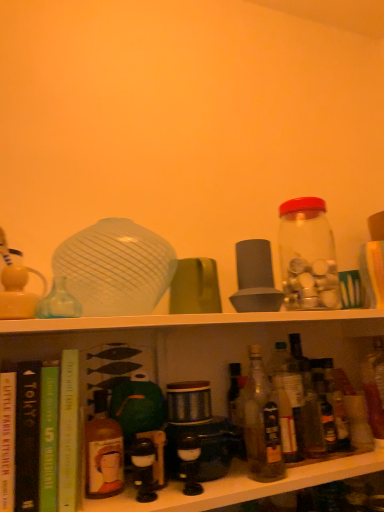
This screenshot has height=512, width=384. Describe the element at coordinates (262, 424) in the screenshot. I see `translucent glass bottle at center, the 3th bottle viewed from the left` at that location.

The height and width of the screenshot is (512, 384). What do you see at coordinates (59, 302) in the screenshot?
I see `transparent glass bottle at left, marked as the first bottle in a left-to-right arrangement` at bounding box center [59, 302].

What do you see at coordinates (7, 440) in the screenshot? I see `hardcover book at left, placed as the fourth book when sorted from right to left` at bounding box center [7, 440].

What do you see at coordinates (103, 451) in the screenshot? This screenshot has width=384, height=512. I see `matte brown glass bottle at center-left, arranged as the 4th bottle when viewed from the right` at bounding box center [103, 451].

In order to click on translucent glass bottle at center, acting as the third bottle starting from the right in this screenshot , I will do `click(262, 424)`.

From a real-world perspective, which is physically above, matte brown glass bottle at center-left, positioned as the second bottle in left-to-right order, or translucent glass bottle at center, the 3th bottle viewed from the left?

translucent glass bottle at center, the 3th bottle viewed from the left, is physically above.

Which point is more distant from viewer, (x=95, y=442) or (x=268, y=405)?

The point (x=268, y=405) is more distant.

Does green matte book at lower left, which is the 2th book from right to left, have a greater height compared to transparent glass bottle at left, marked as the 5th bottle in a right-to-left arrangement?

Yes, green matte book at lower left, which is the 2th book from right to left, is taller than transparent glass bottle at left, marked as the 5th bottle in a right-to-left arrangement.

From the image's perspective, which is below, green matte book at lower left, arranged as the third book when viewed from the left, or transparent glass bottle at left, marked as the first bottle in a left-to-right arrangement?

green matte book at lower left, arranged as the third book when viewed from the left, appears lower in the image.

Can you confirm if green matte book at lower left, arranged as the third book when viewed from the left, is thinner than transparent glass bottle at left, marked as the 5th bottle in a right-to-left arrangement?

No.

Is green matte book at lower left, which is the 2th book from right to left, positioned with its back to transparent glass bottle at left, marked as the first bottle in a left-to-right arrangement?

green matte book at lower left, which is the 2th book from right to left, does not have its back to transparent glass bottle at left, marked as the first bottle in a left-to-right arrangement.

Is green matte book at lower left, arranged as the third book when viewed from the left, outside of hardcover book at center, the first book in the right-to-left sequence?

Yes.

Consider the image. Between green matte book at lower left, which is the 2th book from right to left, and hardcover book at center, acting as the fourth book starting from the left, which one has larger size?

Bigger between the two is hardcover book at center, acting as the fourth book starting from the left.

Can you confirm if green matte book at lower left, arranged as the third book when viewed from the left, is positioned to the left of hardcover book at center, the first book in the right-to-left sequence?

Yes.

Which is more to the left, green matte mug at center, the first tableware viewed from the right, or translucent glass bottle at center, which appears as the 2th bottle when viewed from the right?

green matte mug at center, the first tableware viewed from the right, is more to the left.

Based on the photo, does green matte mug at center, which is counted as the 2th tableware, starting from the left, have a lesser height compared to translucent glass bottle at center, which appears as the 2th bottle when viewed from the right?

Yes, green matte mug at center, which is counted as the 2th tableware, starting from the left, is shorter than translucent glass bottle at center, which appears as the 2th bottle when viewed from the right.

Does point (196, 306) lie behind point (294, 431)?

No, (196, 306) is in front of (294, 431).

Considering the points (13, 267) and (21, 429), which point is behind, point (13, 267) or point (21, 429)?

The point (13, 267) is more distant.

Considering the sizes of matte white teapot at left and black matte book at left, positioned as the third book in right-to-left order, in the image, is matte white teapot at left wider or thinner than black matte book at left, positioned as the third book in right-to-left order,?

Considering their sizes, matte white teapot at left looks slimmer than black matte book at left, positioned as the third book in right-to-left order.

From a real-world perspective, who is located lower, matte white teapot at left or black matte book at left, positioned as the third book in right-to-left order?

In real-world perspective, black matte book at left, positioned as the third book in right-to-left order, is lower.

Could you measure the distance between matte white teapot at left and black matte book at left, positioned as the third book in right-to-left order?

matte white teapot at left and black matte book at left, positioned as the third book in right-to-left order, are 7.13 inches apart from each other.

Can you confirm if transparent glass bottle at left, marked as the 5th bottle in a right-to-left arrangement, is bigger than green matte book at lower left, which is the 2th book from right to left?

Incorrect, transparent glass bottle at left, marked as the 5th bottle in a right-to-left arrangement, is not larger than green matte book at lower left, which is the 2th book from right to left.

From a real-world perspective, is transparent glass bottle at left, marked as the first bottle in a left-to-right arrangement, physically located above or below green matte book at lower left, arranged as the third book when viewed from the left?

transparent glass bottle at left, marked as the first bottle in a left-to-right arrangement, is situated higher than green matte book at lower left, arranged as the third book when viewed from the left, in the real world.

Is transparent glass bottle at left, marked as the 5th bottle in a right-to-left arrangement, thinner than green matte book at lower left, arranged as the third book when viewed from the left?

Indeed, transparent glass bottle at left, marked as the 5th bottle in a right-to-left arrangement, has a lesser width compared to green matte book at lower left, arranged as the third book when viewed from the left.

Is transparent glass bottle at left, marked as the first bottle in a left-to-right arrangement, situated inside green matte book at lower left, arranged as the third book when viewed from the left, or outside?

transparent glass bottle at left, marked as the first bottle in a left-to-right arrangement, exists outside the volume of green matte book at lower left, arranged as the third book when viewed from the left.

From a real-world perspective, between translucent glass bottle at center, the 3th bottle viewed from the left, and matte brown glass bottle at center-left, positioned as the second bottle in left-to-right order, who is vertically higher?

translucent glass bottle at center, the 3th bottle viewed from the left, is physically above.

From the image's perspective, is translucent glass bottle at center, acting as the third bottle starting from the right, located above matte brown glass bottle at center-left, positioned as the second bottle in left-to-right order?

Correct, translucent glass bottle at center, acting as the third bottle starting from the right, appears higher than matte brown glass bottle at center-left, positioned as the second bottle in left-to-right order, in the image.

Between translucent glass bottle at center, acting as the third bottle starting from the right, and matte brown glass bottle at center-left, arranged as the 4th bottle when viewed from the right, which one has smaller size?

matte brown glass bottle at center-left, arranged as the 4th bottle when viewed from the right, is smaller.

Considering the sizes of translucent glass bottle at center, acting as the third bottle starting from the right, and matte brown glass bottle at center-left, positioned as the second bottle in left-to-right order, in the image, is translucent glass bottle at center, acting as the third bottle starting from the right, wider or thinner than matte brown glass bottle at center-left, positioned as the second bottle in left-to-right order,?

In the image, translucent glass bottle at center, acting as the third bottle starting from the right, appears to be wider than matte brown glass bottle at center-left, positioned as the second bottle in left-to-right order.

At what (x,y) coordinates should I click in order to perform the action: click on the 1st bottle behind the matte brown glass bottle at center-left, positioned as the second bottle in left-to-right order. Please return your answer as a coordinate pair (x, y). Looking at the image, I should click on (262, 424).

From the image's perspective, starting from the transparent glass bottle at left, marked as the 5th bottle in a right-to-left arrangement, which book is the 4th one below? Please provide its 2D coordinates.

[(49, 437)]

When comparing their distances from translucent glass vase at upper center, the first tableware from the left, does black matte book at left, positioned as the third book in right-to-left order, or green matte mug at center, the first tableware viewed from the right, seem closer?

Based on the image, green matte mug at center, the first tableware viewed from the right, appears to be nearer to translucent glass vase at upper center, the first tableware from the left.

When comparing their distances from transparent glass bottle at left, marked as the first bottle in a left-to-right arrangement, does green matte book at lower left, which is the 2th book from right to left, or matte white teapot at left seem closer?

The object closer to transparent glass bottle at left, marked as the first bottle in a left-to-right arrangement, is matte white teapot at left.

Which object lies further to the anchor point transparent glass bottle at left, marked as the 5th bottle in a right-to-left arrangement, black matte book at left, the 2th book in the left-to-right sequence, or green matte mug at center, the first tableware viewed from the right?

The object further to transparent glass bottle at left, marked as the 5th bottle in a right-to-left arrangement, is green matte mug at center, the first tableware viewed from the right.

Based on their spatial positions, is black matte book at left, positioned as the third book in right-to-left order, or transparent glass jar at upper right, the fifth bottle from the left, further from green matte mug at center, the first tableware viewed from the right?

The object further to green matte mug at center, the first tableware viewed from the right, is black matte book at left, positioned as the third book in right-to-left order.

Considering their positions, is translucent glass vase at upper center, the first tableware from the left, positioned further to translucent glass bottle at center, which appears as the 2th bottle when viewed from the right, than green matte mug at center, which is counted as the 2th tableware, starting from the left?

The object further to translucent glass bottle at center, which appears as the 2th bottle when viewed from the right, is translucent glass vase at upper center, the first tableware from the left.

Considering their positions, is hardcover book at left, which is counted as the 1th book, starting from the left, positioned closer to translucent glass vase at upper center, the second tableware when ordered from right to left, than black matte book at left, positioned as the third book in right-to-left order?

The object closer to translucent glass vase at upper center, the second tableware when ordered from right to left, is black matte book at left, positioned as the third book in right-to-left order.

Looking at the image, which one is located further to matte white teapot at left, transparent glass bottle at left, marked as the first bottle in a left-to-right arrangement, or translucent glass vase at upper center, the second tableware when ordered from right to left?

translucent glass vase at upper center, the second tableware when ordered from right to left.

Considering their positions, is transparent glass jar at upper right, the fifth bottle from the left, positioned further to transparent glass bottle at left, marked as the 5th bottle in a right-to-left arrangement, than hardcover book at left, which is counted as the 1th book, starting from the left?

The object further to transparent glass bottle at left, marked as the 5th bottle in a right-to-left arrangement, is transparent glass jar at upper right, the fifth bottle from the left.

Where is `tableware that lies between translucent glass vase at upper center, the first tableware from the left, and translucent glass bottle at center, acting as the third bottle starting from the right, from top to bottom`? tableware that lies between translucent glass vase at upper center, the first tableware from the left, and translucent glass bottle at center, acting as the third bottle starting from the right, from top to bottom is located at coordinates (195, 287).

Identify the location of toy between translucent glass vase at upper center, the second tableware when ordered from right to left, and hardcover book at center, the first book in the right-to-left sequence, from top to bottom. Image resolution: width=384 pixels, height=512 pixels. (17, 291).

The height and width of the screenshot is (512, 384). Identify the location of tableware between translucent glass vase at upper center, the second tableware when ordered from right to left, and matte brown glass bottle at center-left, arranged as the 4th bottle when viewed from the right, vertically. (195, 287).

Locate an element on the screen. The image size is (384, 512). tableware between translucent glass vase at upper center, the first tableware from the left, and hardcover book at center, acting as the fourth book starting from the left, in the vertical direction is located at coordinates (195, 287).